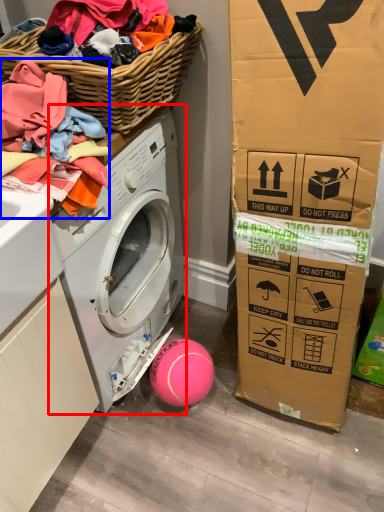
Question: Which object appears farthest to the camera in this image, washing machine (highlighted by a red box) or clothing (highlighted by a blue box)?

Choices:
 (A) washing machine
 (B) clothing

Answer: (A)